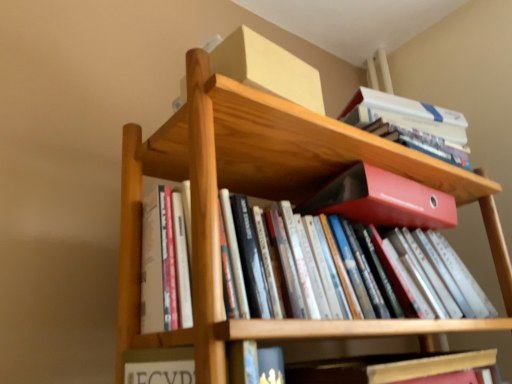
Question: From the image's perspective, relative to hardcover book at lower center, which ranks as the second book in back-to-front order, is matte red folder at center above or below?

Choices:
 (A) below
 (B) above

Answer: (B)

Question: Is point (382, 200) closer or farther from the camera than point (481, 360)?

Choices:
 (A) closer
 (B) farther

Answer: (B)

Question: Which object is positioned farthest from the hardcover book at lower center, which ranks as the second book in back-to-front order?

Choices:
 (A) white paperback book at upper right, positioned as the first book in top-to-bottom order
 (B) matte red folder at center
 (C) wooden bookshelf at center

Answer: (A)

Question: Which of these objects is positioned closest to the white paperback book at upper right, marked as the second book in a front-to-back arrangement?

Choices:
 (A) wooden bookshelf at center
 (B) matte red folder at center
 (C) hardcover book at lower center, which is counted as the first book, starting from the bottom

Answer: (B)